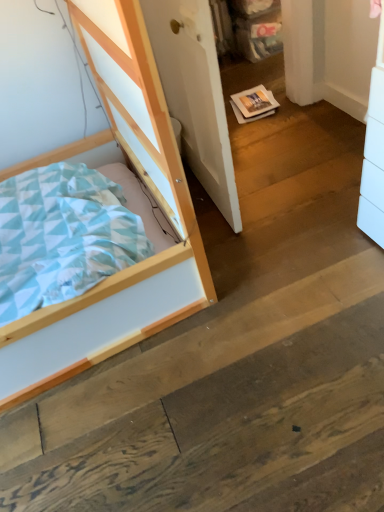
Describe the element at coordinates (195, 94) in the screenshot. I see `white matte door at center` at that location.

At what (x,y) coordinates should I click in order to perform the action: click on white matte door at center. Please return your answer as a coordinate pair (x, y). The image size is (384, 512). Looking at the image, I should click on (195, 94).

What is the approximate height of light wood bed at left?

light wood bed at left is 1.11 meters in height.

The width and height of the screenshot is (384, 512). Describe the element at coordinates (129, 208) in the screenshot. I see `light wood bed at left` at that location.

Locate an element on the screen. This screenshot has width=384, height=512. light wood bed at left is located at coordinates (129, 208).

In order to click on white matte door at center in this screenshot , I will do `click(195, 94)`.

Consider the image. Considering the positions of objects light wood bed at left and white matte door at center in the image provided, who is more to the right, light wood bed at left or white matte door at center?

Positioned to the right is white matte door at center.

Which object is closer to the camera, light wood bed at left or white matte door at center?

light wood bed at left is closer to the camera.

Is point (184, 249) behind point (203, 88)?

No, (184, 249) is in front of (203, 88).

From the image's perspective, which object appears higher, light wood bed at left or white matte door at center?

white matte door at center is shown above in the image.

From a real-world perspective, who is located lower, light wood bed at left or white matte door at center?

white matte door at center, from a real-world perspective.

Which object is thinner, light wood bed at left or white matte door at center?

white matte door at center is thinner.

Between light wood bed at left and white matte door at center, which one has more height?

Standing taller between the two is light wood bed at left.

Looking at the image, does light wood bed at left seem bigger or smaller compared to white matte door at center?

Considering their sizes, light wood bed at left takes up more space than white matte door at center.

Would you say light wood bed at left is inside or outside white matte door at center?

light wood bed at left is outside white matte door at center.

Looking at this image, is light wood bed at left not close to white matte door at center?

That's not correct — light wood bed at left is a little close to white matte door at center.

Is light wood bed at left oriented towards white matte door at center?

No.

Can you tell me how much light wood bed at left and white matte door at center differ in facing direction?

The facing directions of light wood bed at left and white matte door at center are 93.2 degrees apart.

How distant is light wood bed at left from white matte door at center?

light wood bed at left is 13.91 inches away from white matte door at center.

I want to click on door below the light wood bed at left (from a real-world perspective), so click(x=195, y=94).

Considering the relative positions of white matte door at center and light wood bed at left in the image provided, is white matte door at center to the left of light wood bed at left from the viewer's perspective?

No.

Considering the positions of objects white matte door at center and light wood bed at left in the image provided, who is in front, white matte door at center or light wood bed at left?

light wood bed at left.

Does point (215, 105) lie in front of point (79, 327)?

No.

Based on the photo, from the image's perspective, which object appears higher, white matte door at center or light wood bed at left?

white matte door at center appears higher in the image.

From a real-world perspective, is white matte door at center positioned above or below light wood bed at left?

white matte door at center is below light wood bed at left.

Is white matte door at center thinner than light wood bed at left?

Yes.

Considering the sizes of objects white matte door at center and light wood bed at left in the image provided, who is shorter, white matte door at center or light wood bed at left?

white matte door at center.

Considering the relative sizes of white matte door at center and light wood bed at left in the image provided, is white matte door at center smaller than light wood bed at left?

Correct, white matte door at center occupies less space than light wood bed at left.

Is white matte door at center positioned beyond the bounds of light wood bed at left?

Indeed, white matte door at center is completely outside light wood bed at left.

Would you consider white matte door at center to be distant from light wood bed at left?

No, white matte door at center is not far away from light wood bed at left.

Is white matte door at center looking in the opposite direction of light wood bed at left?

Yes.

Can you tell me how much white matte door at center and light wood bed at left differ in facing direction?

white matte door at center and light wood bed at left are facing 93.2 degrees away from each other.

Find the location of `door behind the light wood bed at left`. door behind the light wood bed at left is located at coordinates (195, 94).

At what (x,y) coordinates should I click in order to perform the action: click on door above the light wood bed at left (from the image's perspective). Please return your answer as a coordinate pair (x, y). Looking at the image, I should click on (195, 94).

What are the coordinates of `door on the right of light wood bed at left` in the screenshot? It's located at (195, 94).